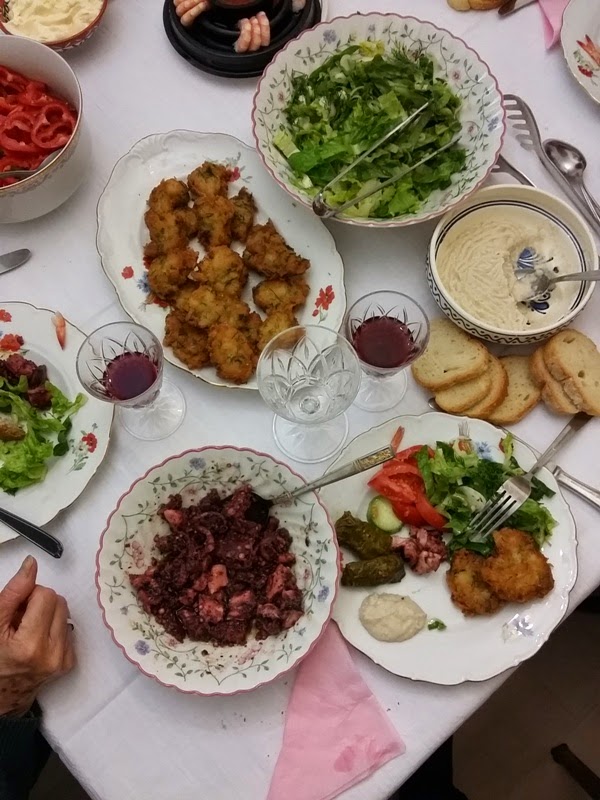
Locate an element on the screen. This screenshot has height=800, width=600. spoon is located at coordinates (364, 462), (567, 150).